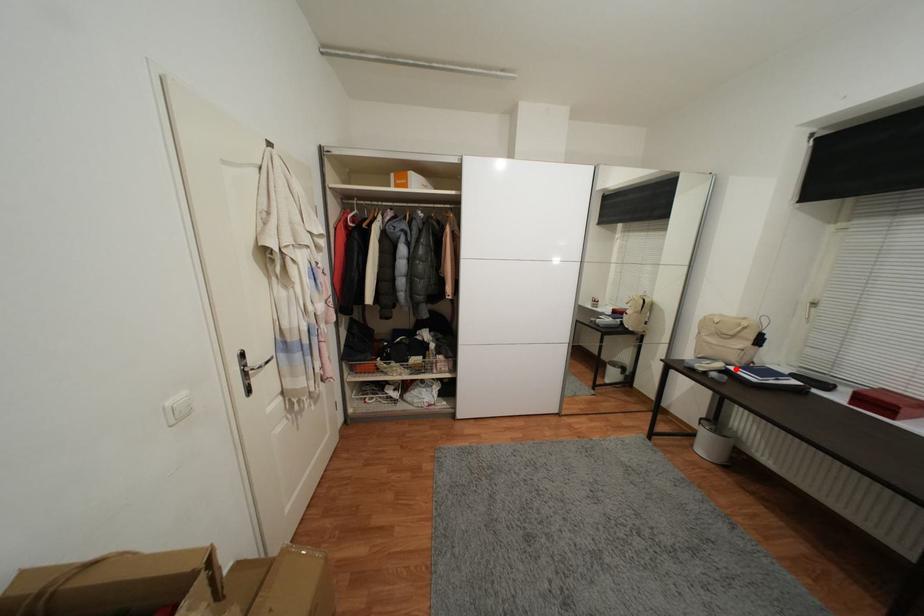
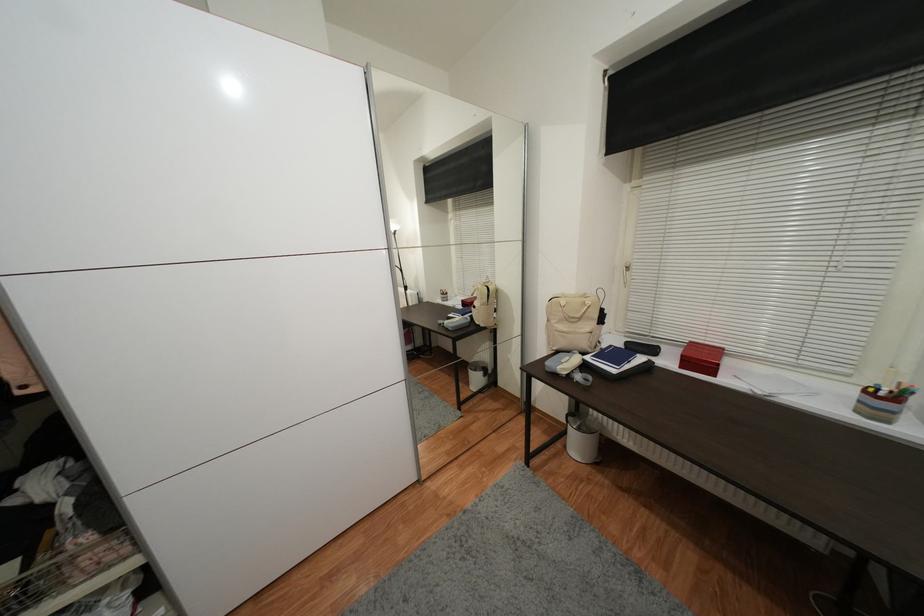
Where in the second image is the point corresponding to the highlighted location from the first image?

(592, 360)